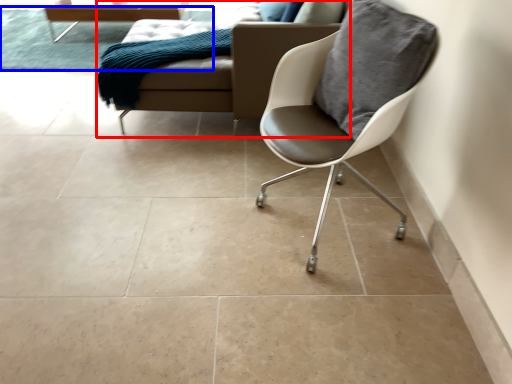
Question: Among these objects, which one is farthest to the camera, studio couch (highlighted by a red box) or mat (highlighted by a blue box)?

Choices:
 (A) studio couch
 (B) mat

Answer: (B)